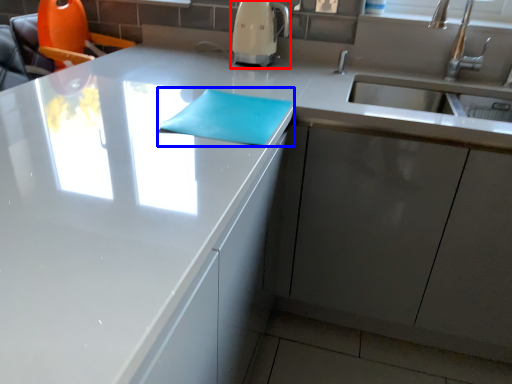
Question: Which point is further to the camera, coffee machine (highlighted by a red box) or notepad (highlighted by a blue box)?

Choices:
 (A) coffee machine
 (B) notepad

Answer: (A)